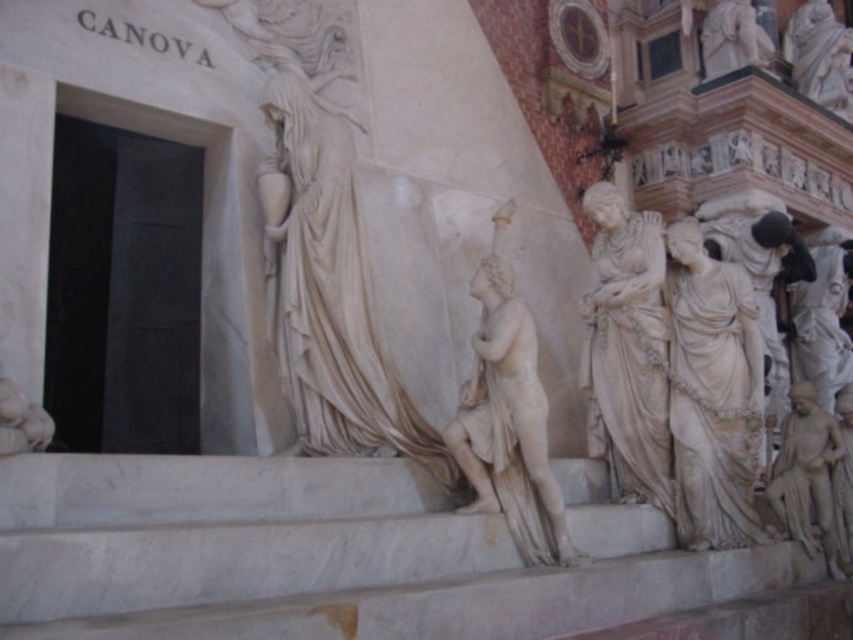
You are standing in front of the Canova sculpture and want to take a photo. You notice two points on the sculpture marked at coordinates point (606,253) and point (471,426). Which point will appear closer to the camera in your photo?

Point (606,253) is further to the camera than point (471,426), so in the photo, point (471,426) will appear closer to the camera.

You are an art conservator tasked with measuring the spacing between two elements in the Canova sculpture. You need to ensure that the white marble draped cloth at right and the white marble statue at right are spaced appropriately for structural integrity. Given that the minimum required distance for stability is 5 meters, is the current spacing sufficient?

The distance between the white marble draped cloth at right and the white marble statue at right is 5.87 meters, which exceeds the minimum required 5 meters for structural stability. Therefore, the current spacing is sufficient.